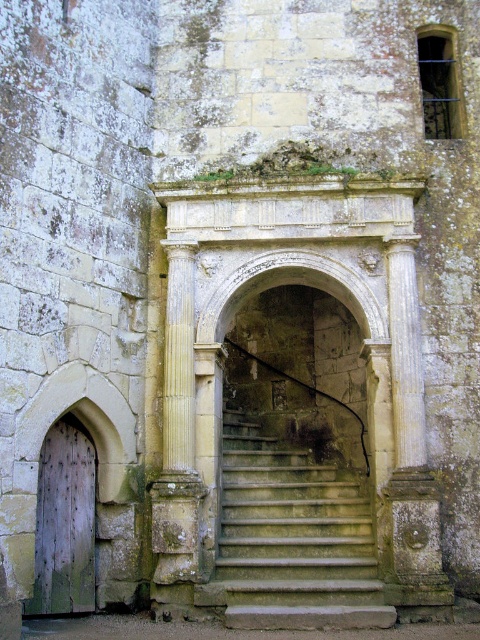
Describe the element at coordinates (291, 538) in the screenshot. I see `stone steps at center` at that location.

Is stone steps at center to the right of yellow stone column at center from the viewer's perspective?

Indeed, stone steps at center is positioned on the right side of yellow stone column at center.

This screenshot has height=640, width=480. Find the location of `stone steps at center`. stone steps at center is located at coordinates (291, 538).

Does stone steps at center have a smaller size compared to weathered wood door at lower left?

No.

Which is above, stone steps at center or weathered wood door at lower left?

weathered wood door at lower left is above.

Find the location of a particular element. This screenshot has height=640, width=480. stone steps at center is located at coordinates (291, 538).

Who is more forward, [170,522] or [90,525]?

Positioned in front is point [170,522].

Which of these two, yellow stone column at center or weathered wood door at lower left, stands shorter?

weathered wood door at lower left is shorter.

Which is behind, point (193, 580) or point (66, 602)?

Positioned behind is point (66, 602).

Where is `yellow stone column at center`? This screenshot has width=480, height=640. yellow stone column at center is located at coordinates (178, 435).